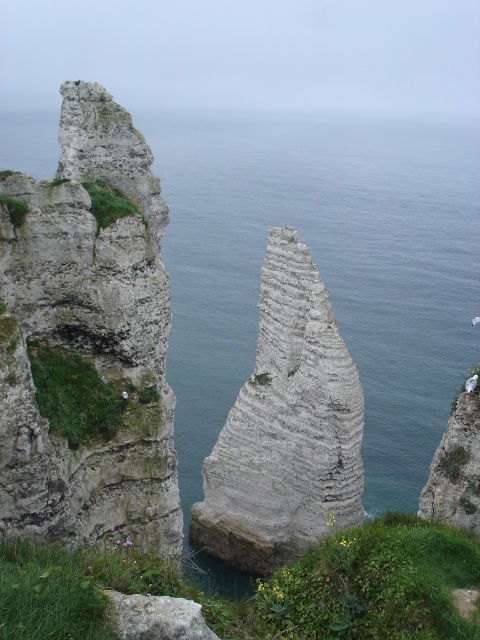
Is white rough rock at left below gray stone rock at center?

No, white rough rock at left is not below gray stone rock at center.

Who is more distant from viewer, (130, 129) or (228, 544)?

The point (228, 544) is behind.

You are a GUI agent. You are given a task and a screenshot of the screen. Output one action in this format:
    pyautogui.click(x=<x>, y=<y>)
    Task: Click on the white rough rock at left
    Image resolution: width=480 pixels, height=640 pixels.
    Given the screenshot: What is the action you would take?
    pyautogui.click(x=86, y=339)

The image size is (480, 640). Find the location of `white rough rock at left`. white rough rock at left is located at coordinates (86, 339).

Is gray stone rock at center positioned in front of gray rough rock at lower center?

No, gray stone rock at center is behind gray rough rock at lower center.

Who is positioned more to the left, gray stone rock at center or gray rough rock at lower center?

gray rough rock at lower center

Which is in front, point (287, 477) or point (176, 600)?

Point (176, 600) is more forward.

This screenshot has width=480, height=640. I want to click on gray stone rock at center, so [x=286, y=428].

Does blue water at center have a greater width compared to white rough rock at left?

Yes, blue water at center is wider than white rough rock at left.

What do you see at coordinates (324, 269) in the screenshot? I see `blue water at center` at bounding box center [324, 269].

Does point (191, 371) come farther from viewer compared to point (60, 504)?

Yes, it is behind point (60, 504).

Identify the location of blue water at center. The height and width of the screenshot is (640, 480). (324, 269).